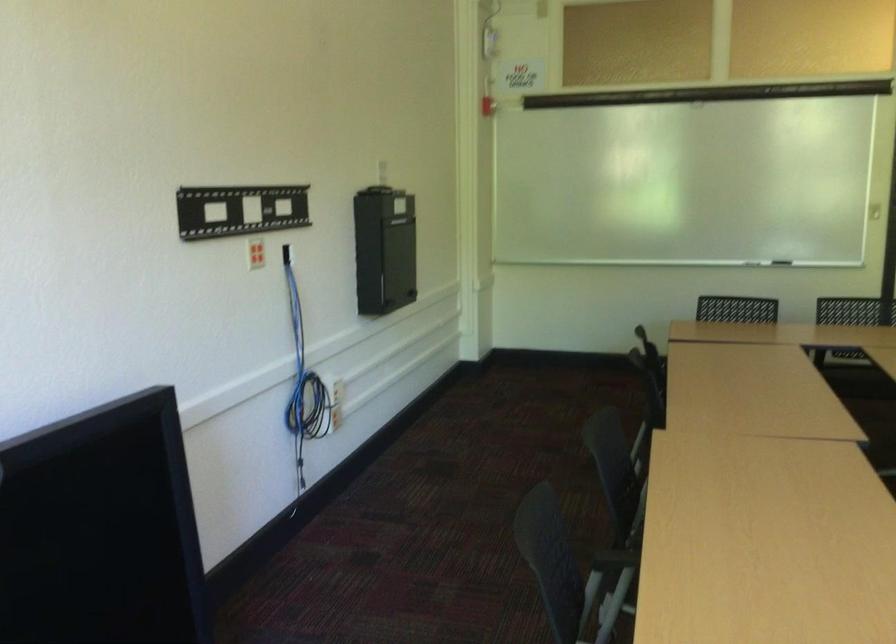
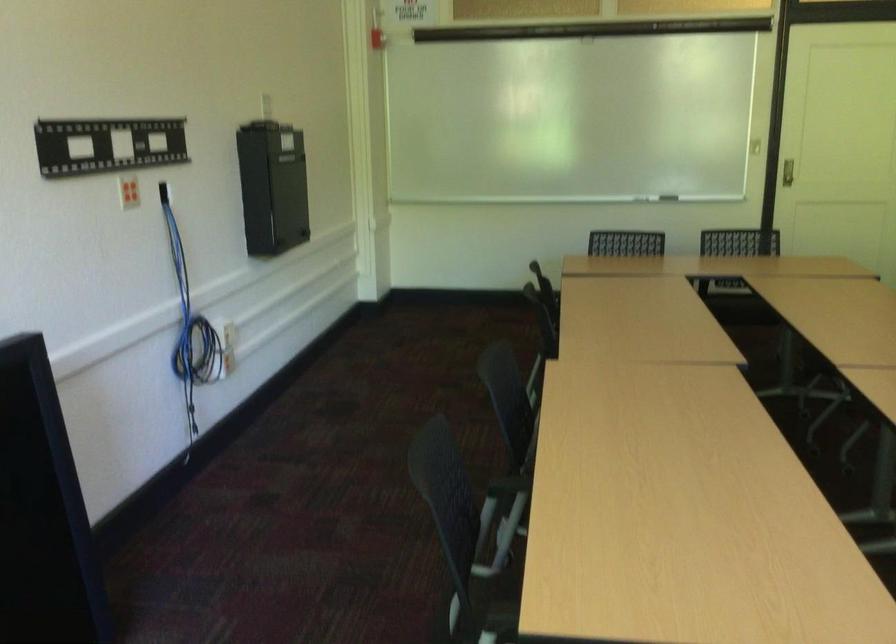
Question: The images are taken continuously from a first-person perspective. In which direction are you moving?

Choices:
 (A) Left
 (B) Right
 (C) Forward
 (D) Backward

Answer: (C)